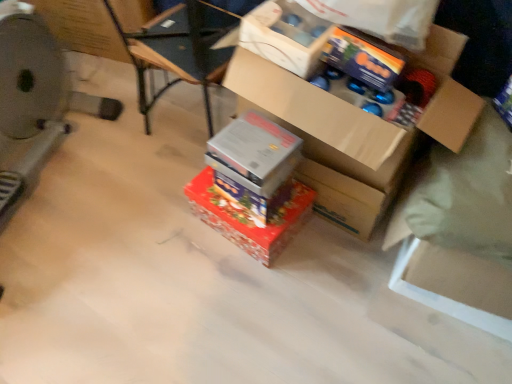
Question: Is shiny metallic box at center, positioned as the 3th box in top-to-bottom order, inside metallic silver exercise machine at left?

Choices:
 (A) yes
 (B) no

Answer: (B)

Question: Is metallic silver exercise machine at left not near shiny metallic box at center, positioned as the 3th box in top-to-bottom order?

Choices:
 (A) no
 (B) yes

Answer: (A)

Question: Is metallic silver exercise machine at left thinner than shiny metallic box at center, the first box in the bottom-to-top sequence?

Choices:
 (A) yes
 (B) no

Answer: (B)

Question: Is metallic silver exercise machine at left looking in the opposite direction of shiny metallic box at center, positioned as the 3th box in top-to-bottom order?

Choices:
 (A) yes
 (B) no

Answer: (B)

Question: From the image's perspective, would you say metallic silver exercise machine at left is shown under shiny metallic box at center, positioned as the 3th box in top-to-bottom order?

Choices:
 (A) no
 (B) yes

Answer: (A)

Question: In terms of size, does cardboard box at upper left appear bigger or smaller than cardboard box at center, which appears as the 1th box when viewed from the top?

Choices:
 (A) small
 (B) big

Answer: (B)

Question: Considering the positions of point (66, 44) and point (303, 115), is point (66, 44) closer or farther from the camera than point (303, 115)?

Choices:
 (A) closer
 (B) farther

Answer: (B)

Question: Is cardboard box at upper left in front of or behind cardboard box at center, positioned as the third box in bottom-to-top order, in the image?

Choices:
 (A) front
 (B) behind

Answer: (B)

Question: Is cardboard box at upper left wider or thinner than cardboard box at center, which appears as the 1th box when viewed from the top?

Choices:
 (A) wide
 (B) thin

Answer: (A)

Question: From a real-world perspective, is shiny orange wrapping paper at upper center above or below cardboard box at upper center?

Choices:
 (A) above
 (B) below

Answer: (A)

Question: Is point (318, 1) positioned closer to the camera than point (242, 41)?

Choices:
 (A) farther
 (B) closer

Answer: (B)

Question: Considering the positions of shiny orange wrapping paper at upper center and cardboard box at upper center in the image, is shiny orange wrapping paper at upper center wider or thinner than cardboard box at upper center?

Choices:
 (A) thin
 (B) wide

Answer: (B)

Question: Is shiny orange wrapping paper at upper center taller or shorter than cardboard box at upper center?

Choices:
 (A) short
 (B) tall

Answer: (B)

Question: From the image's perspective, relative to cardboard box at center, which appears as the 1th box when viewed from the top, is shiny metallic box at center, positioned as the 3th box in top-to-bottom order, above or below?

Choices:
 (A) below
 (B) above

Answer: (A)

Question: Is point (199, 195) closer or farther from the camera than point (378, 125)?

Choices:
 (A) closer
 (B) farther

Answer: (B)